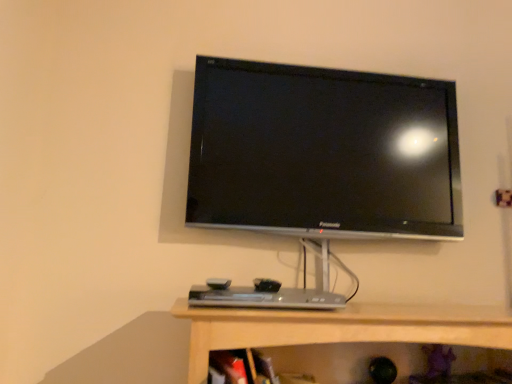
What do you see at coordinates (323, 152) in the screenshot? I see `black glossy tv at upper center` at bounding box center [323, 152].

Locate an element on the screen. The width and height of the screenshot is (512, 384). black glossy tv at upper center is located at coordinates (323, 152).

Image resolution: width=512 pixels, height=384 pixels. What are the coordinates of `silver metallic desktop at center` in the screenshot? It's located at (265, 298).

What do you see at coordinates (265, 298) in the screenshot? I see `silver metallic desktop at center` at bounding box center [265, 298].

Locate an element on the screen. black glossy tv at upper center is located at coordinates (323, 152).

Based on their positions, is silver metallic desktop at center located to the left or right of black glossy tv at upper center?

Based on their positions, silver metallic desktop at center is located to the left of black glossy tv at upper center.

Is silver metallic desktop at center in front of or behind black glossy tv at upper center in the image?

silver metallic desktop at center is positioned closer to the viewer than black glossy tv at upper center.

Does point (224, 295) come closer to viewer compared to point (454, 139)?

Yes.

From the image's perspective, is silver metallic desktop at center located above black glossy tv at upper center?

No.

From a real-world perspective, between silver metallic desktop at center and black glossy tv at upper center, who is vertically lower?

In real-world perspective, silver metallic desktop at center is lower.

Which object is thinner, silver metallic desktop at center or black glossy tv at upper center?

black glossy tv at upper center.

In terms of height, does silver metallic desktop at center look taller or shorter compared to black glossy tv at upper center?

In the image, silver metallic desktop at center appears to be shorter than black glossy tv at upper center.

Looking at this image, between silver metallic desktop at center and black glossy tv at upper center, which one has larger size?

black glossy tv at upper center is bigger.

Is silver metallic desktop at center outside of black glossy tv at upper center?

silver metallic desktop at center lies outside black glossy tv at upper center's area.

Is silver metallic desktop at center beside black glossy tv at upper center?

No, silver metallic desktop at center is not beside black glossy tv at upper center.

Is silver metallic desktop at center facing away from black glossy tv at upper center?

No, silver metallic desktop at center is not facing away from black glossy tv at upper center.

How many degrees apart are the facing directions of silver metallic desktop at center and black glossy tv at upper center?

The angle between the facing direction of silver metallic desktop at center and the facing direction of black glossy tv at upper center is 0.0599 degrees.

Locate an element on the screen. This screenshot has height=384, width=512. television behind the silver metallic desktop at center is located at coordinates (323, 152).

Which object is positioned more to the right, black glossy tv at upper center or silver metallic desktop at center?

black glossy tv at upper center.

Between black glossy tv at upper center and silver metallic desktop at center, which one is positioned behind?

black glossy tv at upper center is more distant.

Does point (243, 227) lie in front of point (191, 292)?

No, it is behind (191, 292).

From the image's perspective, between black glossy tv at upper center and silver metallic desktop at center, who is located below?

silver metallic desktop at center, from the image's perspective.

Looking at this image, from a real-world perspective, which is physically above, black glossy tv at upper center or silver metallic desktop at center?

black glossy tv at upper center.

Can you confirm if black glossy tv at upper center is thinner than silver metallic desktop at center?

Yes, black glossy tv at upper center is thinner than silver metallic desktop at center.

Based on the photo, considering the relative sizes of black glossy tv at upper center and silver metallic desktop at center in the image provided, is black glossy tv at upper center shorter than silver metallic desktop at center?

Incorrect, the height of black glossy tv at upper center does not fall short of that of silver metallic desktop at center.

Who is bigger, black glossy tv at upper center or silver metallic desktop at center?

Bigger between the two is black glossy tv at upper center.

Is black glossy tv at upper center positioned beyond the bounds of silver metallic desktop at center?

Absolutely, black glossy tv at upper center is external to silver metallic desktop at center.

Is black glossy tv at upper center directly adjacent to silver metallic desktop at center?

black glossy tv at upper center and silver metallic desktop at center are not in contact.

Is black glossy tv at upper center turned away from silver metallic desktop at center?

No, black glossy tv at upper center is not facing away from silver metallic desktop at center.

What's the angular difference between black glossy tv at upper center and silver metallic desktop at center's facing directions?

0.0599 degrees.

At what (x,y) coordinates should I click in order to perform the action: click on desktop below the black glossy tv at upper center (from a real-world perspective). Please return your answer as a coordinate pair (x, y). Image resolution: width=512 pixels, height=384 pixels. Looking at the image, I should click on (265, 298).

Find the location of `desktop below the black glossy tv at upper center (from a real-world perspective)`. desktop below the black glossy tv at upper center (from a real-world perspective) is located at coordinates (265, 298).

Where is `television above the silver metallic desktop at center (from a real-world perspective)`? television above the silver metallic desktop at center (from a real-world perspective) is located at coordinates (323, 152).